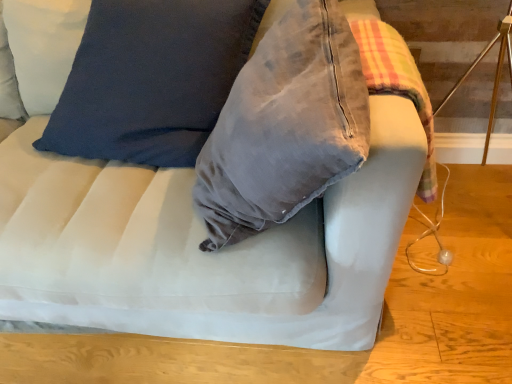
You are a GUI agent. You are given a task and a screenshot of the screen. Output one action in this format:
    pyautogui.click(x=<x>, y=<y>)
    Task: Click on the white fabric mattress at center
    The width and height of the screenshot is (512, 384).
    Given the screenshot: What is the action you would take?
    click(x=139, y=240)

Describe the element at coordinates (139, 240) in the screenshot. This screenshot has width=512, height=384. I see `white fabric mattress at center` at that location.

Measure the distance between white fabric mattress at center and camera.

The depth of white fabric mattress at center is 35.26 inches.

Measure the distance between point (197, 274) and camera.

They are 36.42 inches apart.

At what (x,y) coordinates should I click in order to perform the action: click on white fabric mattress at center. Please return your answer as a coordinate pair (x, y). The image size is (512, 384). Looking at the image, I should click on (139, 240).